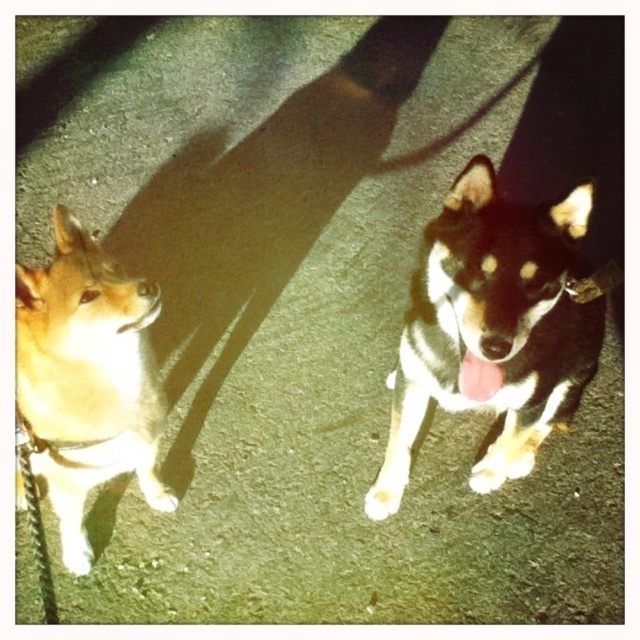
Question: Is black and white fur dog at center closer to camera compared to light brown fur at left?

Choices:
 (A) no
 (B) yes

Answer: (A)

Question: Does black and white fur dog at center appear on the right side of light brown fur at left?

Choices:
 (A) yes
 (B) no

Answer: (A)

Question: Can you confirm if black and white fur dog at center is positioned to the right of light brown fur at left?

Choices:
 (A) yes
 (B) no

Answer: (A)

Question: Which point is closer to the camera?

Choices:
 (A) (579, 342)
 (B) (26, 406)

Answer: (B)